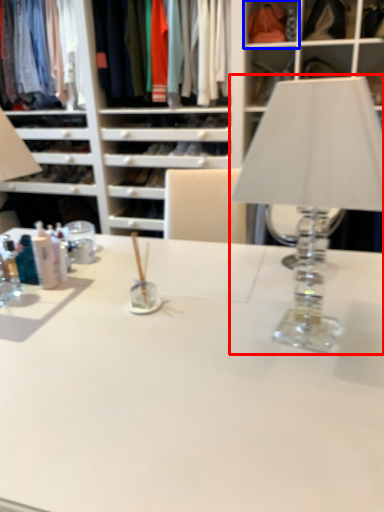
Question: Which object appears closest to the camera in this image, table lamp (highlighted by a red box) or cabinet (highlighted by a blue box)?

Choices:
 (A) table lamp
 (B) cabinet

Answer: (A)